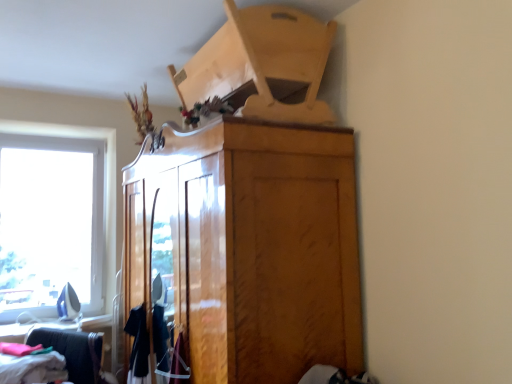
Question: In terms of width, does soft cotton clothes at lower left, which appears as the 3th clothing when viewed from the right, look wider or thinner when compared to velvet burgundy dress at lower center, arranged as the third clothing when viewed from the left?

Choices:
 (A) wide
 (B) thin

Answer: (A)

Question: Which is correct: soft cotton clothes at lower left, which appears as the 3th clothing when viewed from the right, is inside velvet burgundy dress at lower center, acting as the first clothing starting from the right, or outside of it?

Choices:
 (A) outside
 (B) inside

Answer: (A)

Question: Considering the real-world distances, which object is closest to the velvet burgundy dress at lower center, acting as the first clothing starting from the right?

Choices:
 (A) black fabric shirt at lower left, the second clothing in the left-to-right sequence
 (B) matte black clothing at lower left
 (C) glossy wood cabinet at center
 (D) soft cotton clothes at lower left, which appears as the 3th clothing when viewed from the right

Answer: (A)

Question: Which object is the farthest from the soft cotton clothes at lower left, which appears as the 3th clothing when viewed from the right?

Choices:
 (A) glossy wood cabinet at center
 (B) matte black clothing at lower left
 (C) black fabric shirt at lower left, the second clothing in the left-to-right sequence
 (D) velvet burgundy dress at lower center, arranged as the third clothing when viewed from the left

Answer: (A)